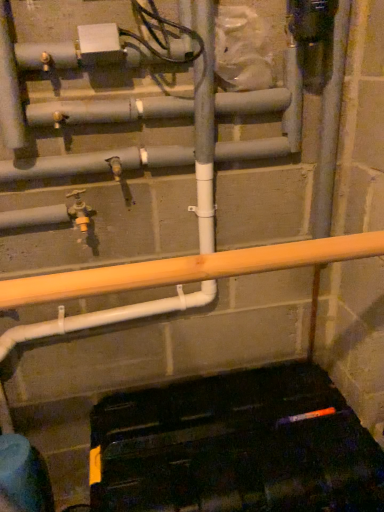
Question: Relative to gray matte pipe at center, acting as the 1th pipe starting from the bottom, is orange wood beam at center in front or behind?

Choices:
 (A) behind
 (B) front

Answer: (B)

Question: Is point (107, 267) closer or farther from the camera than point (117, 151)?

Choices:
 (A) farther
 (B) closer

Answer: (B)

Question: Which of these objects is positioned closest to the matte gray pipe at upper center, arranged as the 1th pipe when viewed from the top?

Choices:
 (A) orange wood beam at center
 (B) gray matte pipe at center, acting as the second pipe starting from the top
 (C) gray matte pipe at center
 (D) matte yellow valve at center-left

Answer: (B)

Question: Which object is positioned closest to the matte yellow valve at center-left?

Choices:
 (A) matte gray pipe at upper center, the 2th pipe when ordered from bottom to top
 (B) orange wood beam at center
 (C) gray matte pipe at center, acting as the 1th pipe starting from the bottom
 (D) gray matte pipe at center

Answer: (C)